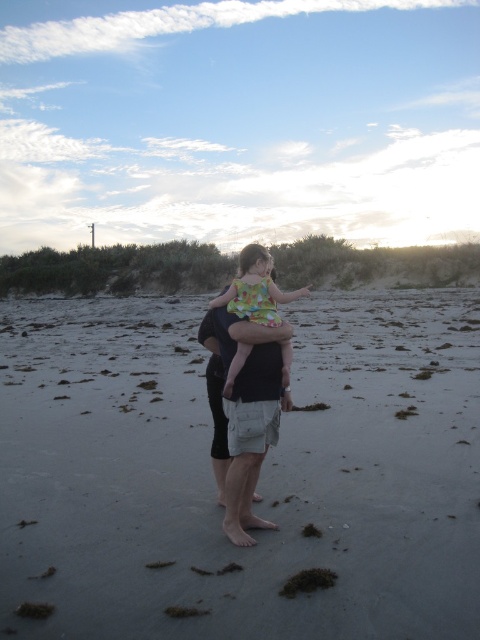
Question: Which of the following is the closest to the observer?

Choices:
 (A) (240, 252)
 (B) (249, 340)

Answer: (B)

Question: Does dark gray shorts at center lie behind floral fabric dress at center?

Choices:
 (A) yes
 (B) no

Answer: (A)

Question: Which object is the closest to the floral fabric dress at center?

Choices:
 (A) gray sand at center
 (B) dark gray shorts at center

Answer: (B)

Question: Considering the relative positions of gray sand at center and dark gray shorts at center in the image provided, where is gray sand at center located with respect to dark gray shorts at center?

Choices:
 (A) below
 (B) above

Answer: (A)

Question: Estimate the real-world distances between objects in this image. Which object is farther from the floral fabric dress at center?

Choices:
 (A) gray sand at center
 (B) dark gray shorts at center

Answer: (A)

Question: Where is dark gray shorts at center located in relation to floral fabric dress at center in the image?

Choices:
 (A) below
 (B) above

Answer: (B)